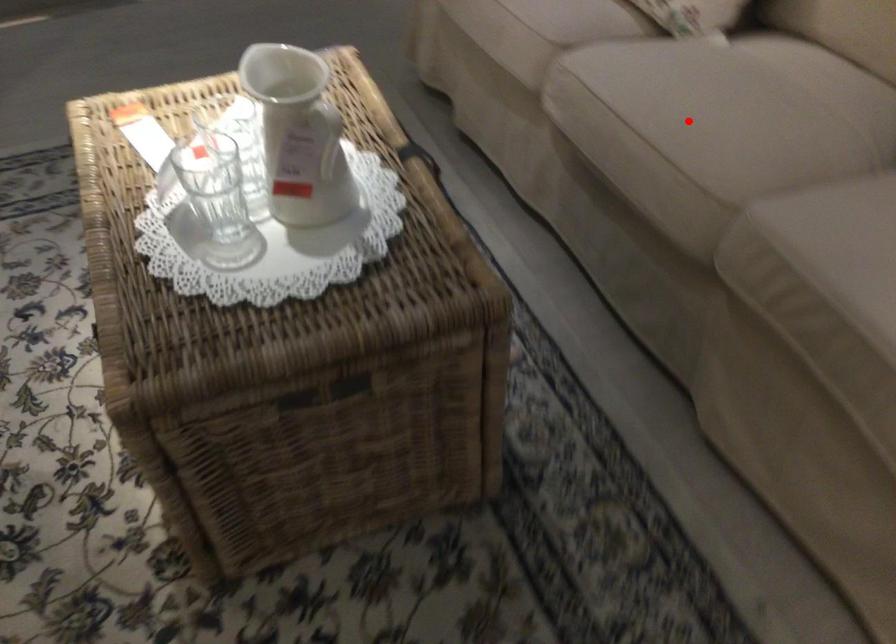
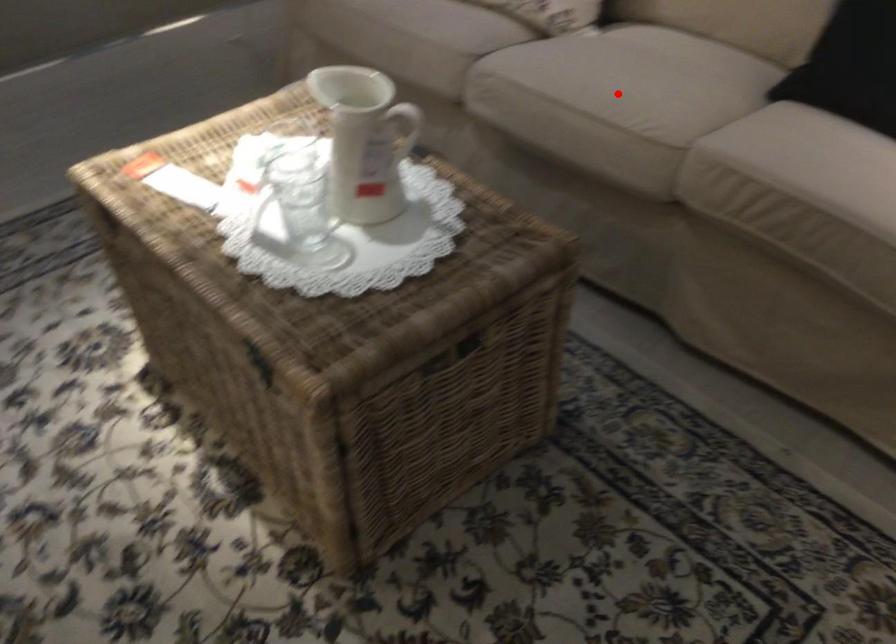
I am providing you with two images of the same scene from different viewpoints. A red point is marked on the first image and another point is marked on the second image. Do the highlighted points in image1 and image2 indicate the same real-world spot?

Yes